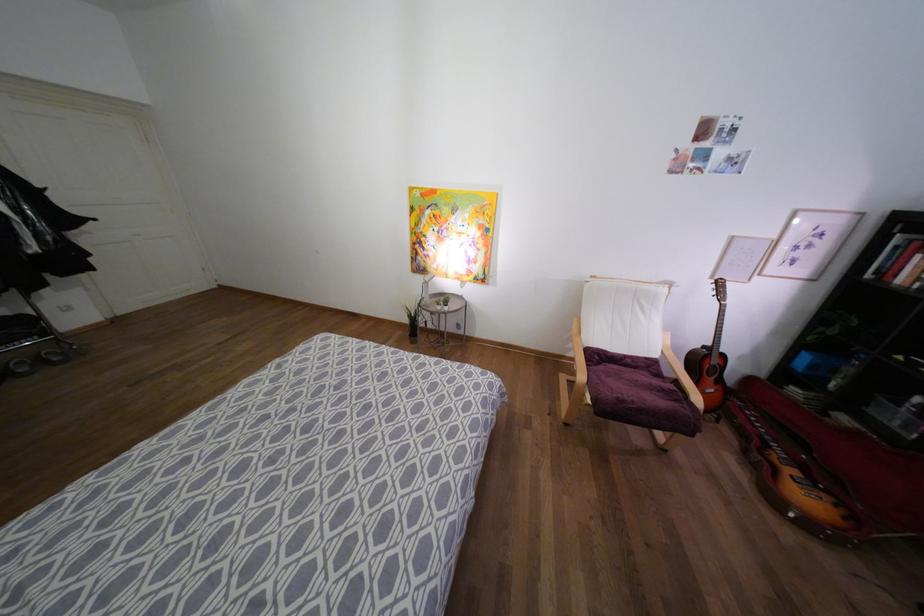
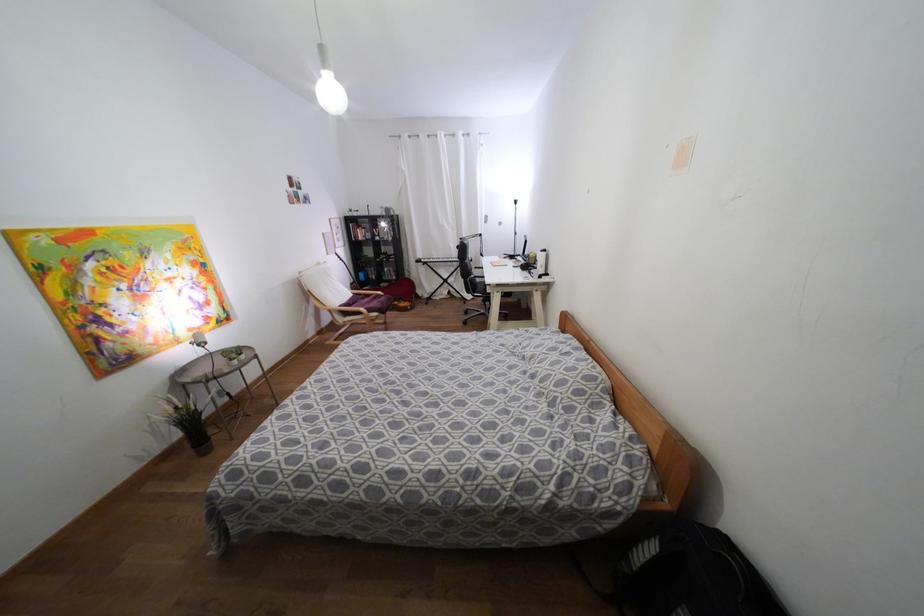
The point at (x=455, y=276) is marked in the first image. Where is the corresponding point in the second image?

(190, 333)